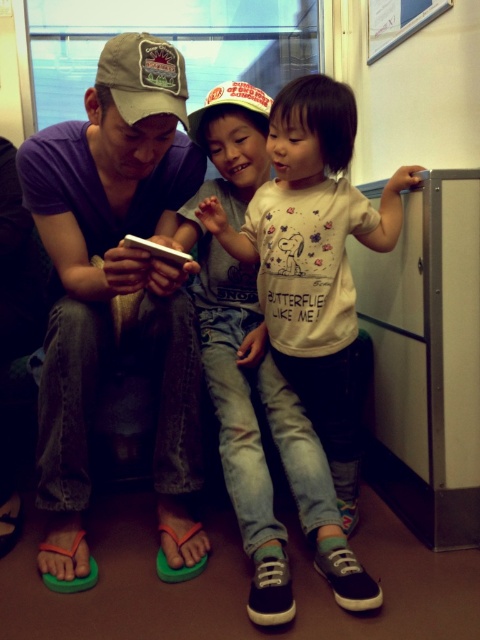
You are a photographer trying to capture a candid shot of the scene. You want to ensure that both the white cotton shirt at center and the white matte baseball cap at center are fully visible in the frame. Based on their positions, is there a risk that one might block the other from view?

The white cotton shirt at center is wider than the white matte baseball cap at center, so there is a possibility that the white cotton shirt at center could block the view of the white matte baseball cap at center if they are positioned closely together.

You are a photographer trying to capture a candid shot of the scene. You want to ensure that both the white cotton shirt at center and the beige fabric baseball cap at upper left are clearly visible in your photo. Considering their sizes, which object should you focus on to ensure both are in frame?

The white cotton shirt at center is larger than the beige fabric baseball cap at upper left, so focusing on the white cotton shirt at center will help ensure both objects are in frame as it is the more prominent one.